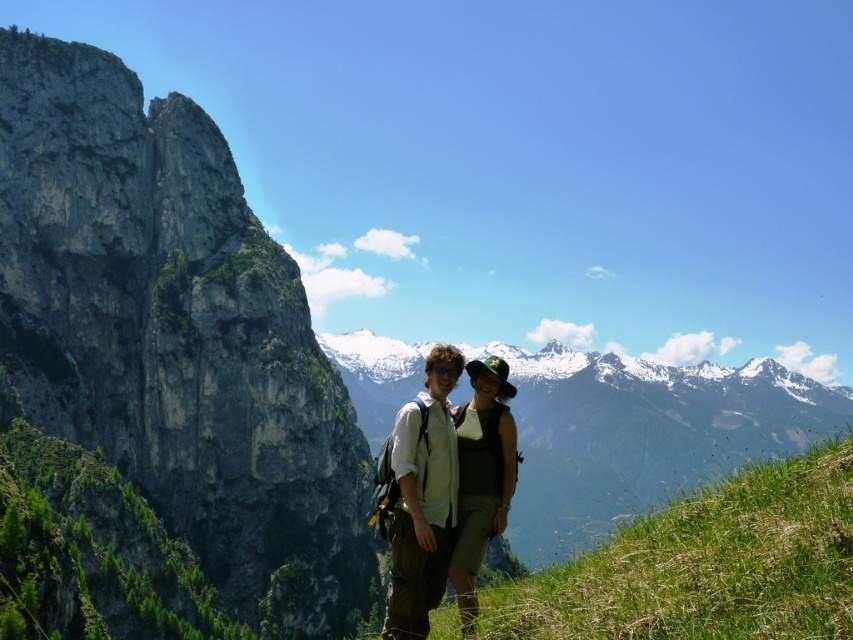
Can you confirm if green grassy hillside at left is smaller than matte white shirt at center?

No.

I want to click on green grassy hillside at left, so click(x=158, y=378).

Is point (225, 268) less distant than point (434, 589)?

That is False.

The width and height of the screenshot is (853, 640). In order to click on green grassy hillside at left in this screenshot , I will do `click(158, 378)`.

Who is taller, green grassy hillside at left or green fabric hat at center?

Standing taller between the two is green grassy hillside at left.

Does green grassy hillside at left have a lesser height compared to green fabric hat at center?

In fact, green grassy hillside at left may be taller than green fabric hat at center.

This screenshot has height=640, width=853. What are the coordinates of `green grassy hillside at left` in the screenshot? It's located at (158, 378).

Locate an element on the screen. green grassy hillside at left is located at coordinates (158, 378).

Does green grassy hillside at lower right lie behind matte white shirt at center?

No, green grassy hillside at lower right is closer to the viewer.

Who is more distant from viewer, (x=717, y=580) or (x=498, y=500)?

Point (x=498, y=500)

Is point (706, 627) closer to camera compared to point (390, 451)?

That is True.

In order to click on green grassy hillside at lower right in this screenshot , I will do `click(701, 564)`.